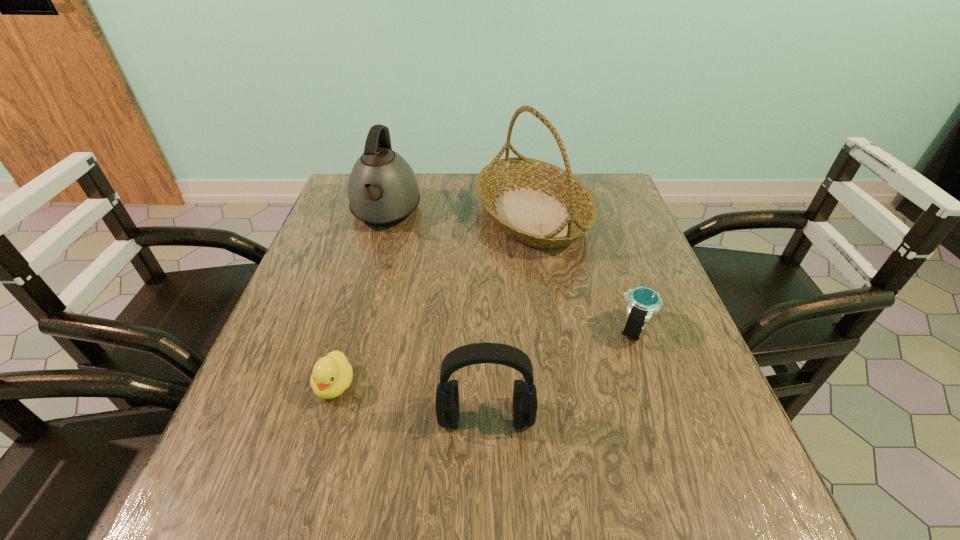
You are a GUI agent. You are given a task and a screenshot of the screen. Output one action in this format:
    pyautogui.click(x=<x>, y=<y>)
    Task: Click on the tallest object
    
    Given the screenshot: What is the action you would take?
    pyautogui.click(x=534, y=202)

I want to click on the fourth shortest object, so click(x=382, y=189).

Identify the location of headset. This screenshot has height=540, width=960. tap(525, 404).

The width and height of the screenshot is (960, 540). Identify the location of the third nearest object. (642, 302).

At what (x,y) coordinates should I click in order to perform the action: click on the shortest object. Please return your answer as a coordinate pair (x, y). This screenshot has height=540, width=960. Looking at the image, I should click on (332, 375).

Locate an element on the screen. This screenshot has width=960, height=540. vacant space positioned on the front of the tallest object is located at coordinates (556, 368).

I want to click on vacant position located 0.070m at the spout of the fourth shortest object, so click(x=372, y=261).

This screenshot has width=960, height=540. I want to click on vacant space situated on the headband of the headset, so click(x=487, y=493).

Find the location of a particular element. The width and height of the screenshot is (960, 540). vacant region located 0.180m on the front of the watch is located at coordinates (671, 435).

Find the location of a particular element. This screenshot has width=960, height=540. vacant space located 0.090m on the beak of the shortest object is located at coordinates (314, 458).